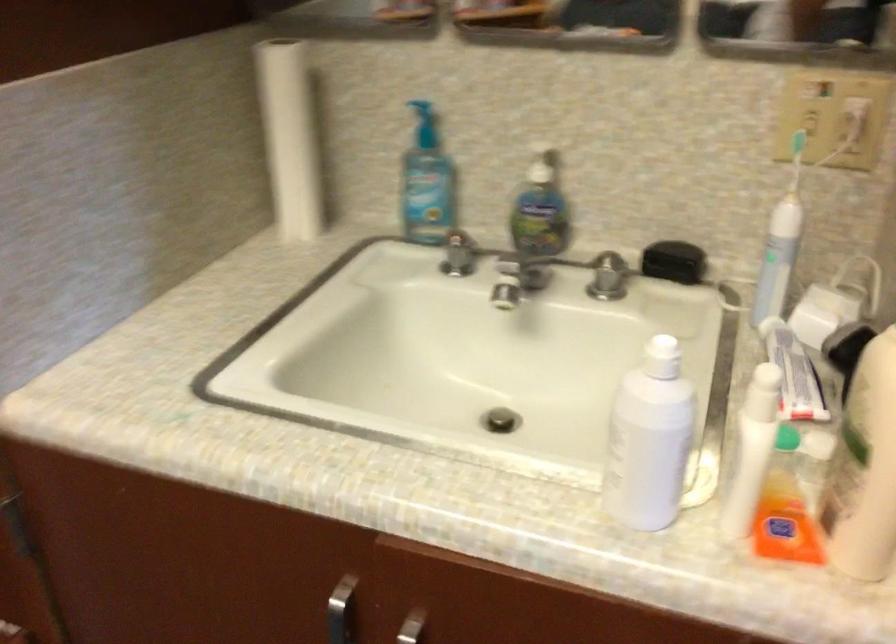
The height and width of the screenshot is (644, 896). What are the coordinates of `blue soap pump` in the screenshot? It's located at (423, 109).